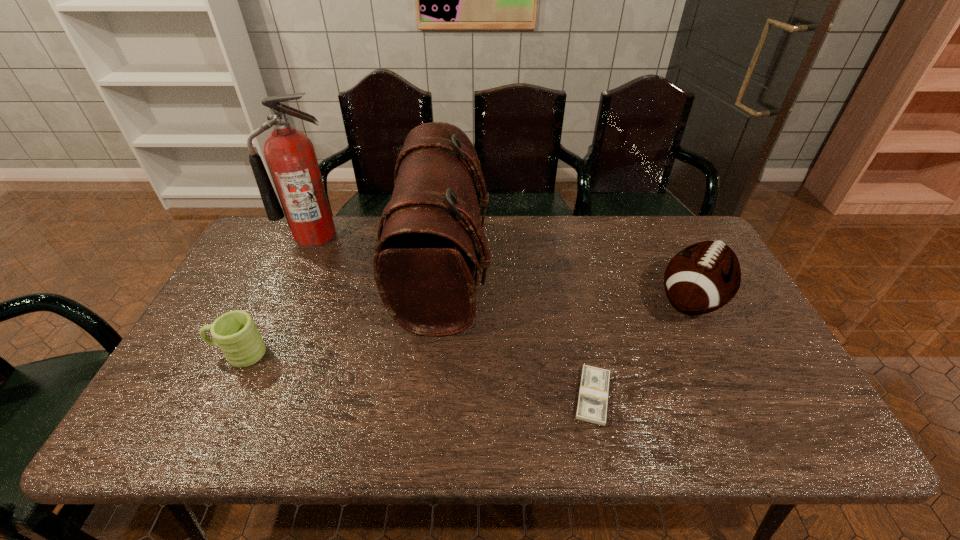
In the image, there is a desktop. Where is `vacant region at the near edge`? The image size is (960, 540). vacant region at the near edge is located at coordinates (420, 413).

Where is `free region at the left edge of the desktop`? This screenshot has width=960, height=540. free region at the left edge of the desktop is located at coordinates (232, 307).

The image size is (960, 540). In the image, there is a desktop. What are the coordinates of `free region at the right edge` in the screenshot? It's located at tap(731, 306).

In the image, there is a desktop. Identify the location of blank space at the near left corner. The image size is (960, 540). (157, 413).

Find the location of a particular element. vacant area at the far right corner is located at coordinates (660, 223).

The height and width of the screenshot is (540, 960). In the image, there is a desktop. What are the coordinates of `free space at the near right corner` in the screenshot? It's located at (804, 430).

Find the location of a particular element. This screenshot has height=540, width=960. free space between the mug and the shortest object is located at coordinates (416, 375).

At what (x,y) coordinates should I click in order to perform the action: click on blank region between the fourth object from left to right and the satchel. Please return your answer as a coordinate pair (x, y). This screenshot has width=960, height=540. Looking at the image, I should click on (518, 334).

Locate an element on the screen. This screenshot has width=960, height=540. free space that is in between the mug and the third object from left to right is located at coordinates (342, 312).

Where is `vacant space in between the third tallest object and the second object from right to left`? vacant space in between the third tallest object and the second object from right to left is located at coordinates (642, 348).